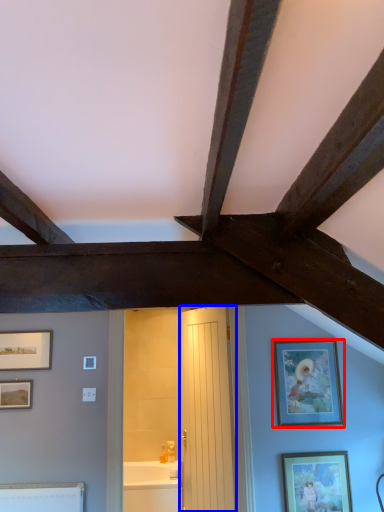
Question: Which of the following is the farthest to the observer, picture frame (highlighted by a red box) or door (highlighted by a blue box)?

Choices:
 (A) picture frame
 (B) door

Answer: (A)